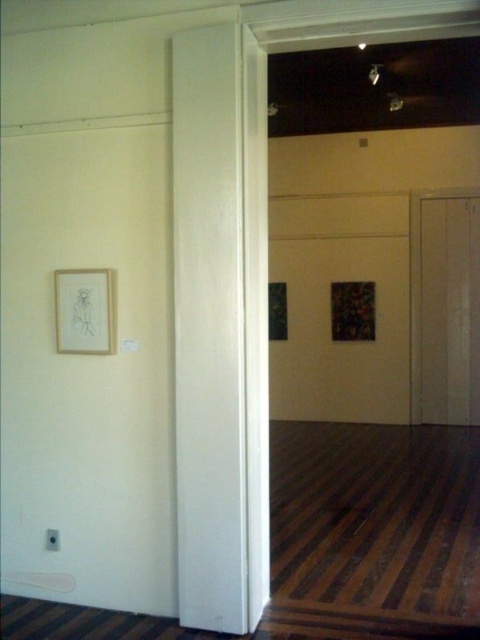
You are standing in the middle of the room and want to exit through the nearest door. Which door should you approach first, the white glossy door at center or the white matte door at right?

The white glossy door at center is to the left of the white matte door at right, so the white glossy door at center is closer to your current position in the middle of the room. Approach the white glossy door at center first.

You are standing in the center of the room and want to exit through the white matte door at right. Based on the room layout, can you estimate whether the door is within a 2.5 meter straight line path from your current position?

The white matte door at right is located at point (450, 308), so the door is within a 2.5 meter straight line path from your current position in the center of the room.